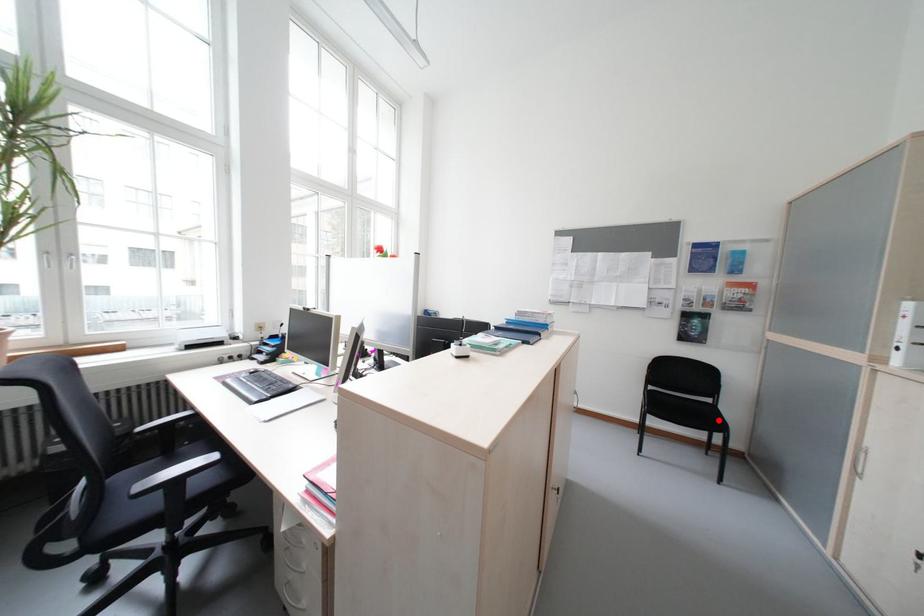
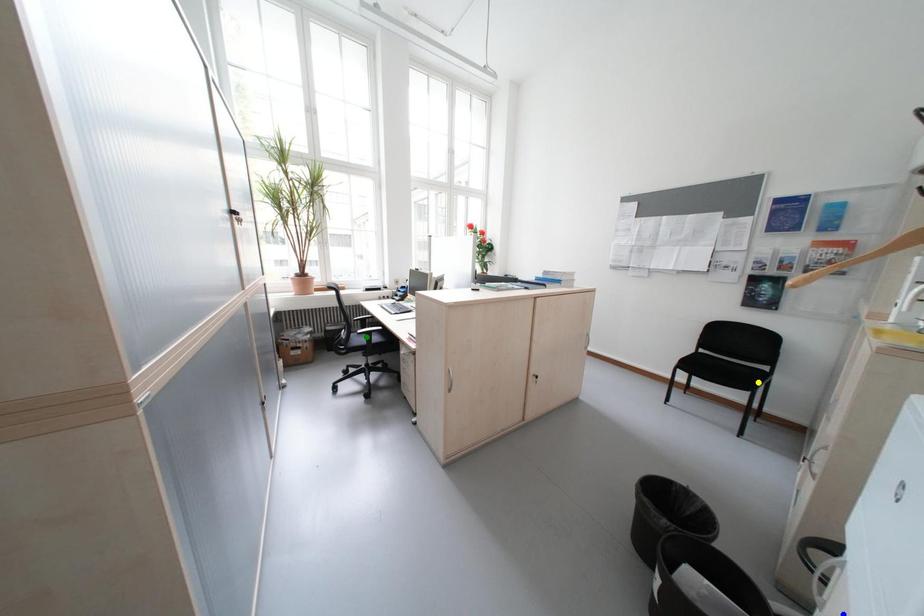
Question: I am providing you with two images of the same scene from different viewpoints. A red point is marked on the first image. You are given multiple points on the second image. In image 2, which mark is for the same physical point as the one in image 1?

Choices:
 (A) yellow point
 (B) green point
 (C) blue point

Answer: (A)